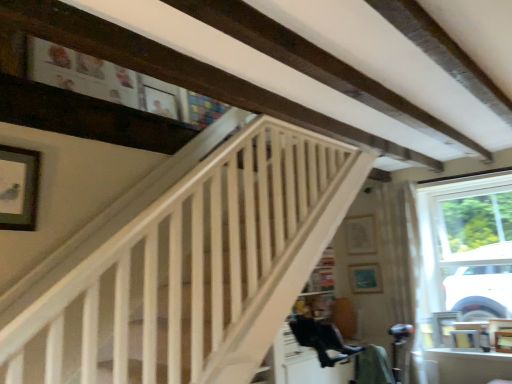
Question: Considering the relative sizes of matte white picture frame at upper center, arranged as the 2th picture frame when viewed from the left, and wooden picture frame at lower right, arranged as the 1th picture frame when ordered from the bottom, in the image provided, is matte white picture frame at upper center, arranged as the 2th picture frame when viewed from the left, smaller than wooden picture frame at lower right, arranged as the 1th picture frame when ordered from the bottom,?

Choices:
 (A) yes
 (B) no

Answer: (A)

Question: Is wooden picture frame at lower right, the fourth picture frame when ordered from top to bottom, at the back of matte white picture frame at upper center, the fourth picture frame when ordered from front to back?

Choices:
 (A) yes
 (B) no

Answer: (B)

Question: From a real-world perspective, is matte white picture frame at upper center, the third picture frame from the bottom, physically above wooden picture frame at lower right, placed as the second picture frame when sorted from front to back?

Choices:
 (A) yes
 (B) no

Answer: (A)

Question: Would you say matte white picture frame at upper center, the 2th picture frame when ordered from top to bottom, contains wooden picture frame at lower right, which ranks as the 1th picture frame in right-to-left order?

Choices:
 (A) yes
 (B) no

Answer: (B)

Question: Considering the relative positions of matte white picture frame at upper center, which is the first picture frame in back-to-front order, and wooden picture frame at lower right, the third picture frame in the back-to-front sequence, in the image provided, is matte white picture frame at upper center, which is the first picture frame in back-to-front order, to the left of wooden picture frame at lower right, the third picture frame in the back-to-front sequence, from the viewer's perspective?

Choices:
 (A) yes
 (B) no

Answer: (A)

Question: Looking at the image, does matte white picture frame at upper center, arranged as the 2th picture frame when viewed from the left, seem bigger or smaller compared to matte black picture frame at upper left, which is counted as the fourth picture frame, starting from the right?

Choices:
 (A) small
 (B) big

Answer: (A)

Question: From the image's perspective, relative to matte black picture frame at upper left, which ranks as the 1th picture frame in top-to-bottom order, is matte white picture frame at upper center, which is the first picture frame in back-to-front order, above or below?

Choices:
 (A) above
 (B) below

Answer: (B)

Question: Considering their positions, is matte white picture frame at upper center, arranged as the 2th picture frame when viewed from the left, located in front of or behind matte black picture frame at upper left, the 1th picture frame viewed from the front?

Choices:
 (A) front
 (B) behind

Answer: (B)

Question: In the image, is matte white picture frame at upper center, the 2th picture frame when ordered from top to bottom, on the left side or the right side of matte black picture frame at upper left, which is counted as the fourth picture frame, starting from the right?

Choices:
 (A) left
 (B) right

Answer: (B)

Question: Considering the positions of matte blue picture frame at center, which appears as the 3th picture frame when viewed from the front, and matte black picture frame at upper left, which is counted as the fourth picture frame, starting from the right, in the image, is matte blue picture frame at center, which appears as the 3th picture frame when viewed from the front, taller or shorter than matte black picture frame at upper left, which is counted as the fourth picture frame, starting from the right,?

Choices:
 (A) short
 (B) tall

Answer: (A)

Question: Considering their positions, is matte blue picture frame at center, the 3th picture frame when ordered from top to bottom, located in front of or behind matte black picture frame at upper left, which appears as the 1th picture frame when viewed from the left?

Choices:
 (A) front
 (B) behind

Answer: (B)

Question: From the image's perspective, is matte blue picture frame at center, the 2th picture frame positioned from the bottom, positioned above or below matte black picture frame at upper left, which is counted as the fourth picture frame, starting from the right?

Choices:
 (A) above
 (B) below

Answer: (B)

Question: Is point (374, 289) positioned closer to the camera than point (9, 213)?

Choices:
 (A) closer
 (B) farther

Answer: (B)

Question: Is matte white picture frame at upper center, arranged as the 2th picture frame when viewed from the left, wider or thinner than matte blue picture frame at center, which is counted as the 2th picture frame, starting from the right?

Choices:
 (A) wide
 (B) thin

Answer: (B)

Question: From the image's perspective, is matte white picture frame at upper center, acting as the third picture frame starting from the right, located above or below matte blue picture frame at center, the 2th picture frame positioned from the bottom?

Choices:
 (A) above
 (B) below

Answer: (A)